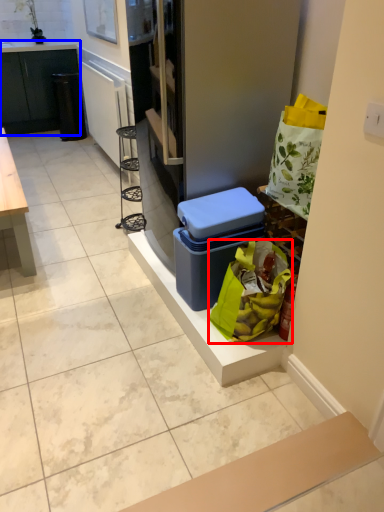
Question: Which object appears farthest to the camera in this image, shopping bag (highlighted by a red box) or cabinetry (highlighted by a blue box)?

Choices:
 (A) shopping bag
 (B) cabinetry

Answer: (B)